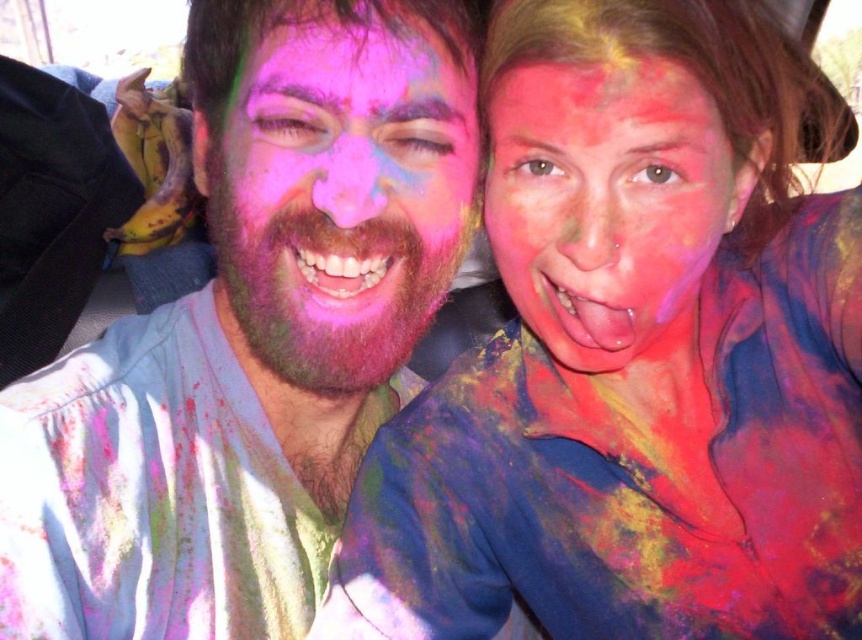
Question: Which point is closer to the camera taking this photo?

Choices:
 (A) (257, 17)
 (B) (678, 163)

Answer: (B)

Question: Is matte multicolored face paint at center to the left of matte multicolored face at center from the viewer's perspective?

Choices:
 (A) no
 (B) yes

Answer: (A)

Question: Is matte multicolored face paint at center thinner than multicolored powder at center?

Choices:
 (A) no
 (B) yes

Answer: (A)

Question: Among these objects, which one is farthest from the camera?

Choices:
 (A) matte multicolored face at center
 (B) matte multicolored face paint at center
 (C) pink matte face at center

Answer: (C)

Question: Does matte multicolored face paint at center appear on the right side of multicolored powder at center?

Choices:
 (A) yes
 (B) no

Answer: (A)

Question: Among these objects, which one is nearest to the camera?

Choices:
 (A) multicolored powder at center
 (B) matte multicolored face paint at center
 (C) pink matte face at center

Answer: (A)